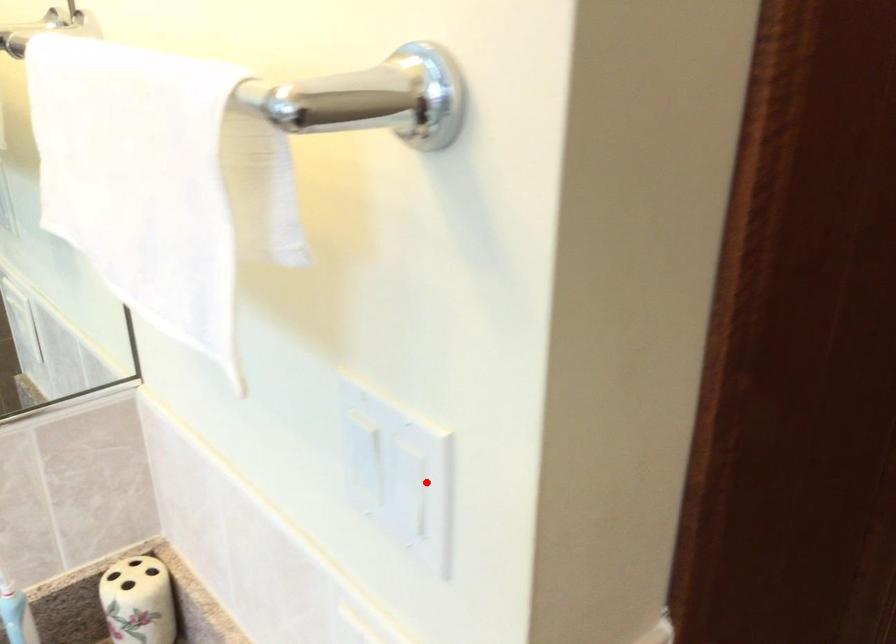
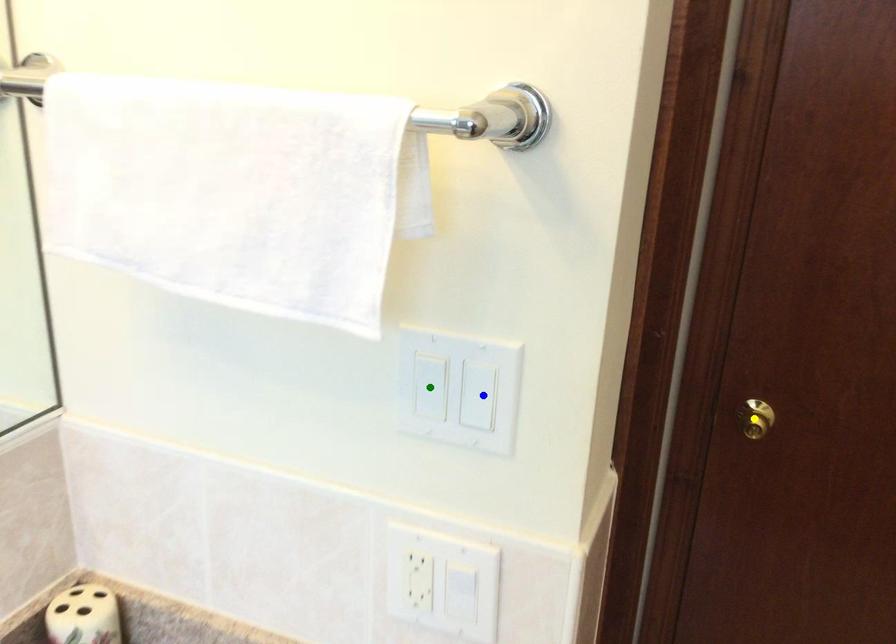
Question: I am providing you with two images of the same scene from different viewpoints. A red point is marked on the first image. You are given multiple points on the second image. Which point in image 2 represents the same 3d spot as the red point in image 1?

Choices:
 (A) blue point
 (B) yellow point
 (C) green point

Answer: (A)